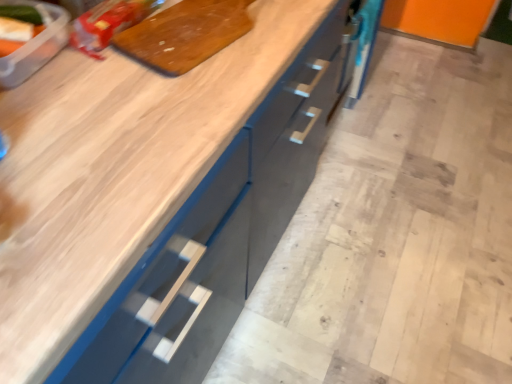
The image size is (512, 384). Identify the location of vacant area that is situated to the right of translucent plastic container at upper left, arranged as the 1th food when viewed from the left. (86, 81).